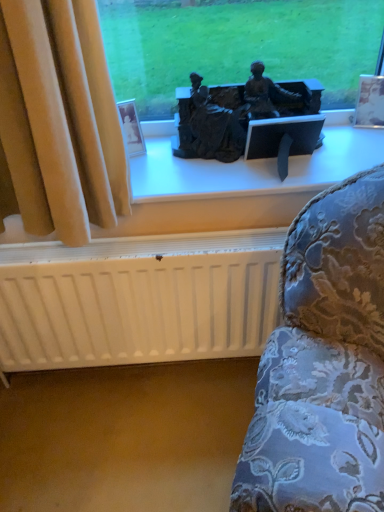
You are a GUI agent. You are given a task and a screenshot of the screen. Output one action in this format:
    pyautogui.click(x=<x>, y=<y>)
    Task: Click on the empty space that is ontop of white matte radiator at lower center (from a real-world perspective)
    This screenshot has height=512, width=384.
    Given the screenshot: What is the action you would take?
    pyautogui.click(x=125, y=246)